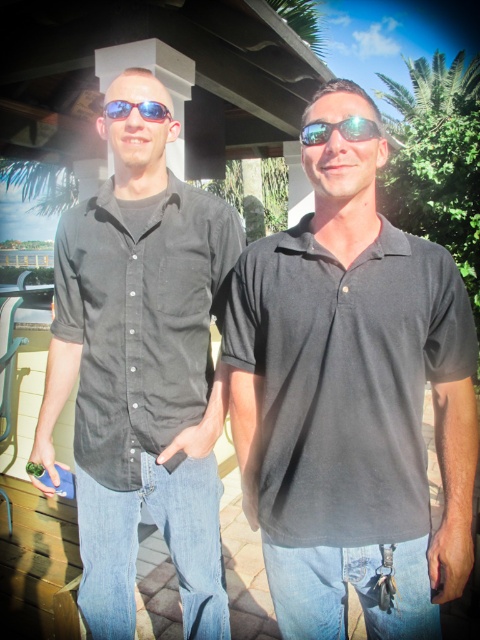
In the scene shown: You are standing in front of the black cotton polo shirt at center. If you want to reach it without moving your feet, can you do it?

The black cotton polo shirt at center is 1.29 meters from viewer, so if you can reach 1.29 meters without moving your feet, you can reach it.

From the picture: You are a photographer trying to capture a closeup of the black cotton polo shirt at center. Based on its position in the image, where would you aim your camera?

The black cotton polo shirt at center is located at the 2D coordinates point (351, 406), so you should aim your camera at that specific point to capture it in focus.